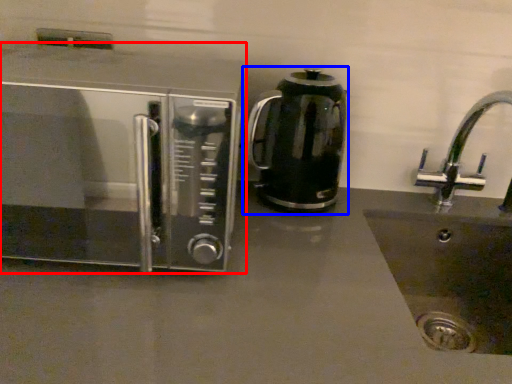
Question: Which object is further to the camera taking this photo, microwave oven (highlighted by a red box) or kitchen appliance (highlighted by a blue box)?

Choices:
 (A) microwave oven
 (B) kitchen appliance

Answer: (B)